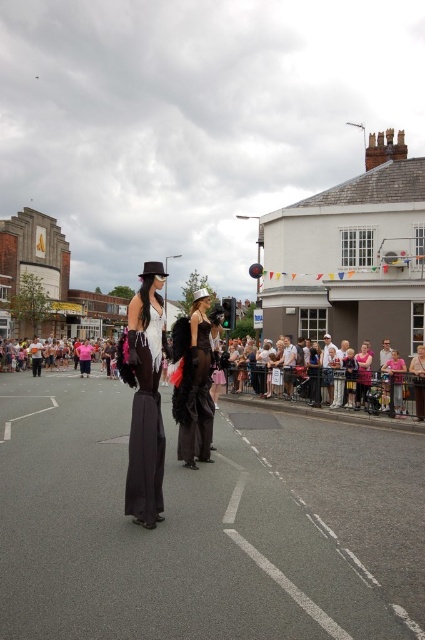
Identify the location of pink fabric crowd at center. (331, 385).

Can you confirm if pink fabric crowd at center is wider than matte black dress at center?

Yes.

Which is behind, point (249, 396) or point (155, 502)?

Positioned behind is point (249, 396).

Find the location of `pink fabric crowd at center`. pink fabric crowd at center is located at coordinates (331, 385).

Measure the distance between pink fabric crowd at center and black satin dress at center.

The distance of pink fabric crowd at center from black satin dress at center is 4.05 meters.

Between pink fabric crowd at center and black satin dress at center, which one appears on the left side from the viewer's perspective?

Positioned to the left is pink fabric crowd at center.

Is point (402, 388) farther from camera compared to point (187, 344)?

Yes, point (402, 388) is behind point (187, 344).

I want to click on pink fabric crowd at center, so click(331, 385).

Does black satin dress at center appear on the right side of matte black dress at center?

Indeed, black satin dress at center is positioned on the right side of matte black dress at center.

Between point (206, 296) and point (138, 456), which one is positioned in front?

Positioned in front is point (138, 456).

Image resolution: width=425 pixels, height=640 pixels. What are the coordinates of `black satin dress at center` in the screenshot? It's located at (193, 381).